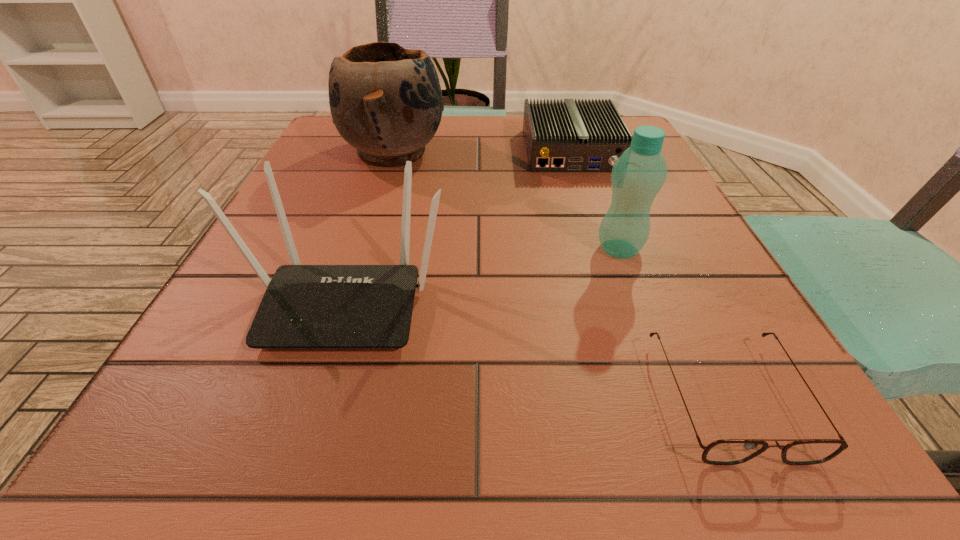
The height and width of the screenshot is (540, 960). Identify the location of object that is at the far right corner. (568, 136).

I want to click on object present at the near right corner, so click(725, 451).

Where is `free space at the far edge`? The image size is (960, 540). free space at the far edge is located at coordinates (510, 137).

The height and width of the screenshot is (540, 960). Find the location of `vacant space at the near edge of the desktop`. vacant space at the near edge of the desktop is located at coordinates tap(424, 467).

In the image, there is a desktop. Where is `free space at the left edge`? free space at the left edge is located at coordinates (332, 184).

Identify the location of blank area at the right edge. (744, 361).

In order to click on free space at the near left corner in this screenshot , I will do `click(229, 407)`.

You are a GUI agent. You are given a task and a screenshot of the screen. Output one action in this format:
    pyautogui.click(x=<x>, y=<y>)
    Task: Click on the vacant space that is in between the bottle and the farther router
    
    Given the screenshot: What is the action you would take?
    pyautogui.click(x=595, y=200)

Locate an element on the screen. This screenshot has height=540, width=960. free space between the pottery and the taller router is located at coordinates (370, 226).

Find the location of a particular element. Image resolution: width=960 pixels, height=540 pixels. vacant space that's between the shorter router and the sunglasses is located at coordinates (650, 274).